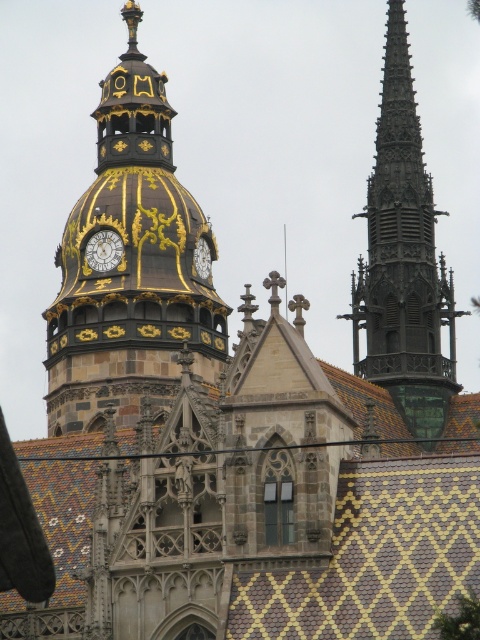
You are standing in front of a grand Gothic building and notice two gold metallic clock at center and goldmetallicclock tower at upper center. Which one is positioned to the left?

The gold metallic clock at center is positioned to the left of the goldmetallicclock tower at upper center.

You are an architect examining the building. You notice the smooth gray steeple at right and the goldmetallicclock tower at upper center. Which of these two structures is located higher up in the image?

The smooth gray steeple at right is positioned over the goldmetallicclock tower at upper center, meaning it is higher up in the image.